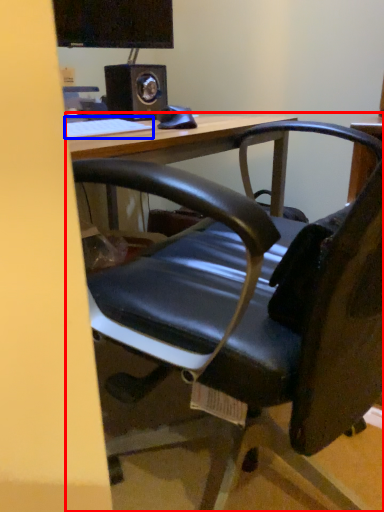
Question: Which object is further to the camera taking this photo, table (highlighted by a red box) or keyboard (highlighted by a blue box)?

Choices:
 (A) table
 (B) keyboard

Answer: (B)